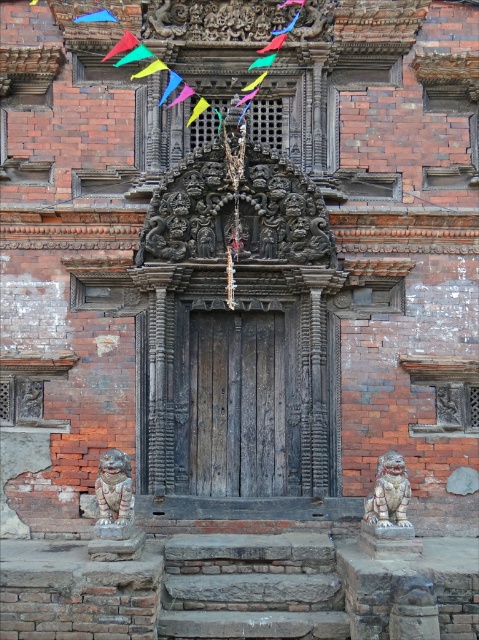
You are a tour guide explaining the entrance of this temple to visitors. You want to mention the sizes of the weathered wood door at center and the polished silver lion at lower left. How do their sizes compare?

The weathered wood door at center is wider than the polished silver lion at lower left.

You are a visitor standing at the entrance of the temple. You notice the polished silver lion at lower left and the blue fabric flag at upper left. Which object is taller when viewed from your perspective?

The polished silver lion at lower left is taller than the blue fabric flag at upper left.

You are a visitor standing at the entrance of the temple. You notice two lions, the polished silver lion at lower left and the white stone lion at lower right. Which lion is taller?

The polished silver lion at lower left is taller than the white stone lion at lower right.